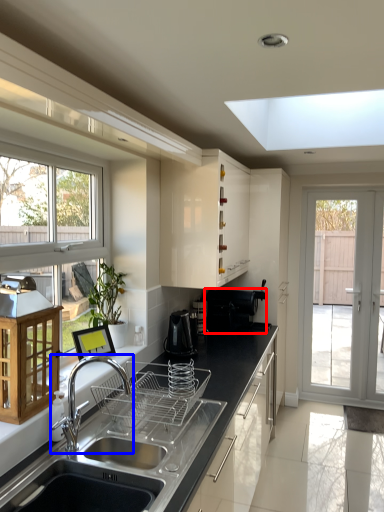
Question: Which point is further to the camera, appliance (highlighted by a red box) or tap (highlighted by a blue box)?

Choices:
 (A) appliance
 (B) tap

Answer: (A)